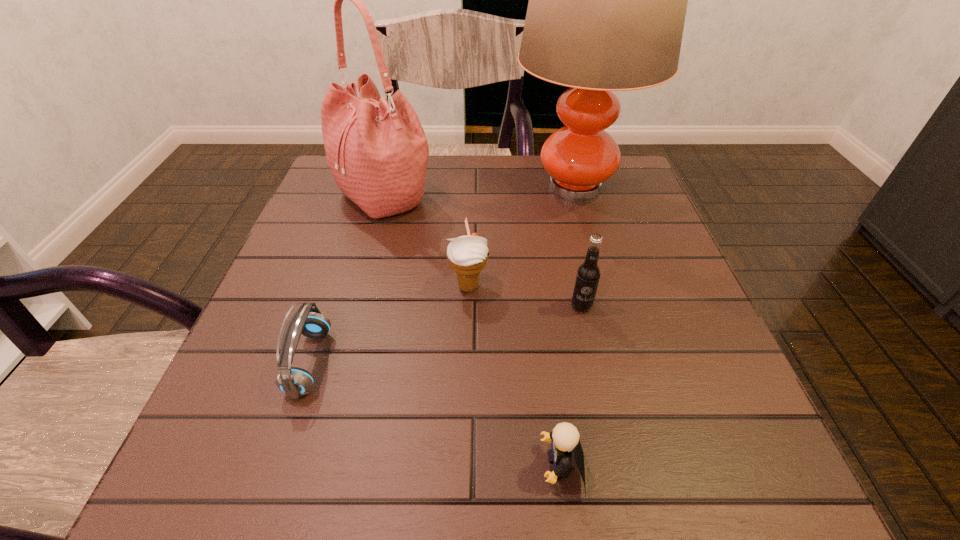
At what (x,y) coordinates should I click in order to perform the action: click on lamp. Please return your answer as a coordinate pair (x, y). This screenshot has height=540, width=960. Looking at the image, I should click on (607, 4).

This screenshot has height=540, width=960. What are the coordinates of `handbag` in the screenshot? It's located at (377, 152).

Identify the location of root beer. (588, 273).

I want to click on the third shortest object, so click(467, 255).

Locate an element on the screen. icecream is located at coordinates (467, 255).

The image size is (960, 540). In order to click on the fifth farthest object in this screenshot , I will do `click(295, 382)`.

The width and height of the screenshot is (960, 540). I want to click on Lego, so click(x=565, y=437).

Where is `free space located on the left of the lamp`? free space located on the left of the lamp is located at coordinates (359, 186).

At what (x,y) coordinates should I click in order to perform the action: click on vacant space located on the right of the fifth shortest object. Please return your answer as a coordinate pair (x, y). Image resolution: width=960 pixels, height=540 pixels. Looking at the image, I should click on (455, 195).

At what (x,y) coordinates should I click in order to perform the action: click on free spot located 0.110m on the label of the root beer. Please return your answer as a coordinate pair (x, y). Looking at the image, I should click on (594, 364).